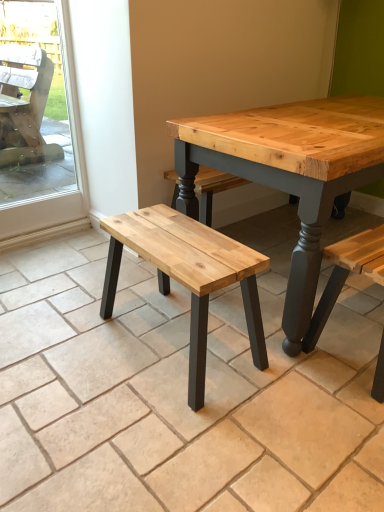
You are a GUI agent. You are given a task and a screenshot of the screen. Output one action in this format:
    pyautogui.click(x=<x>, y=<y>)
    Task: Click on the vacant area that lies to the right of natural wood bench at center
    The height and width of the screenshot is (512, 384).
    Given the screenshot: What is the action you would take?
    pyautogui.click(x=314, y=371)